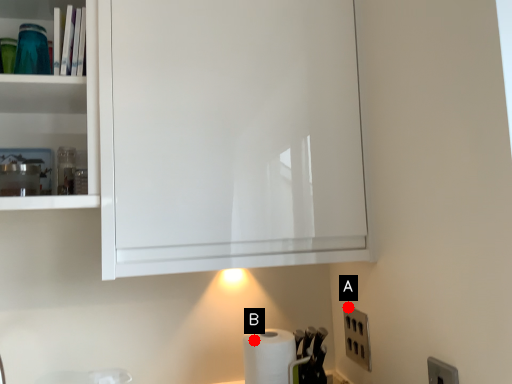
Question: Two points are circled on the image, labeled by A and B beside each circle. Which point is closer to the camera?

Choices:
 (A) A is closer
 (B) B is closer

Answer: (B)